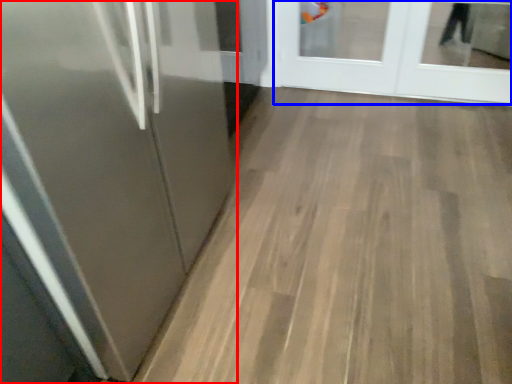
Question: Which of the following is the closest to the observer, door (highlighted by a red box) or door (highlighted by a blue box)?

Choices:
 (A) door
 (B) door

Answer: (A)